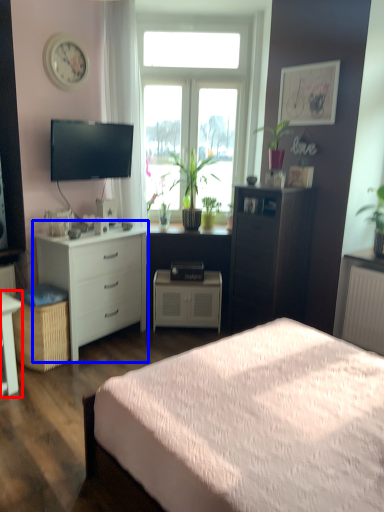
Question: Which object appears farthest to the camera in this image, desk (highlighted by a red box) or chest of drawers (highlighted by a blue box)?

Choices:
 (A) desk
 (B) chest of drawers

Answer: (B)